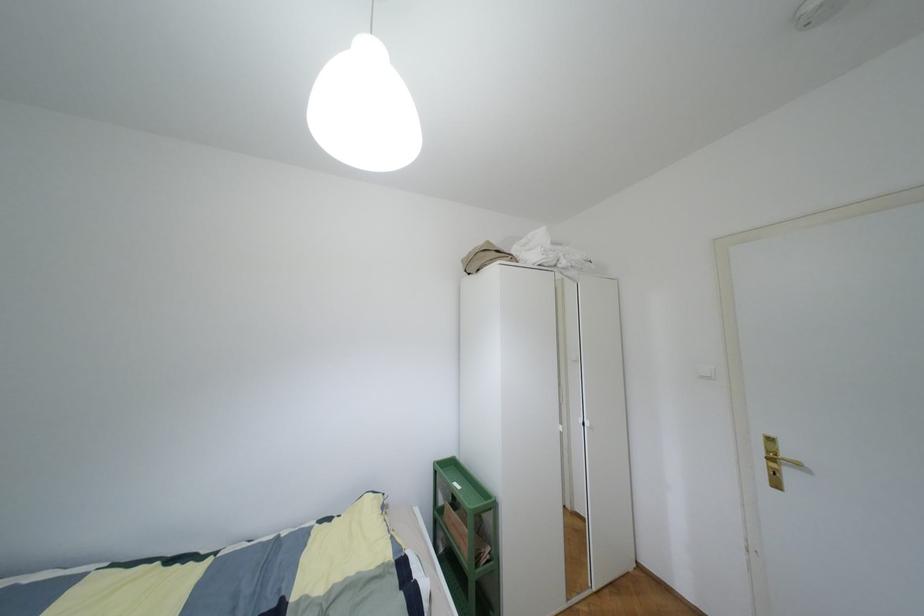
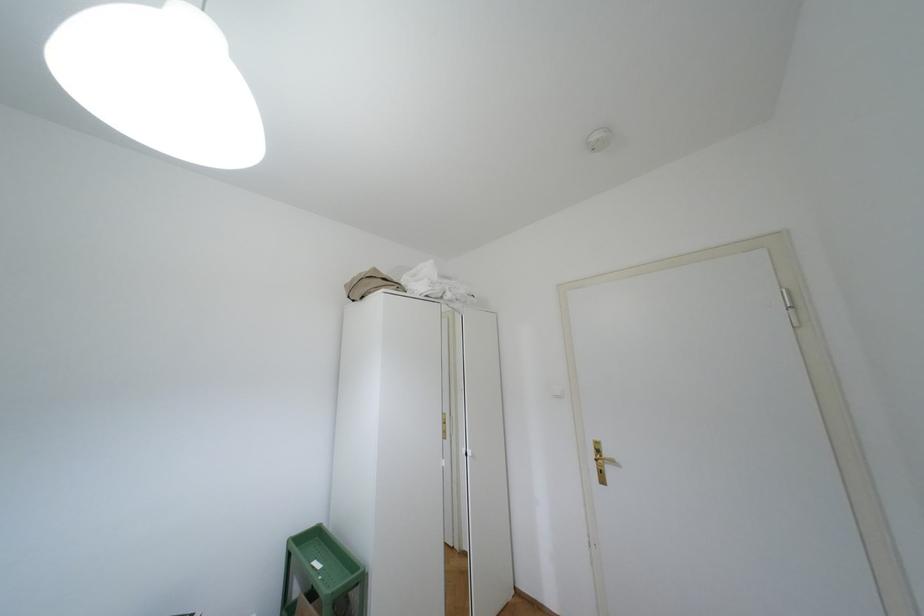
In the second image, find the point that corresponds to point 434,472 in the first image.

(288, 553)